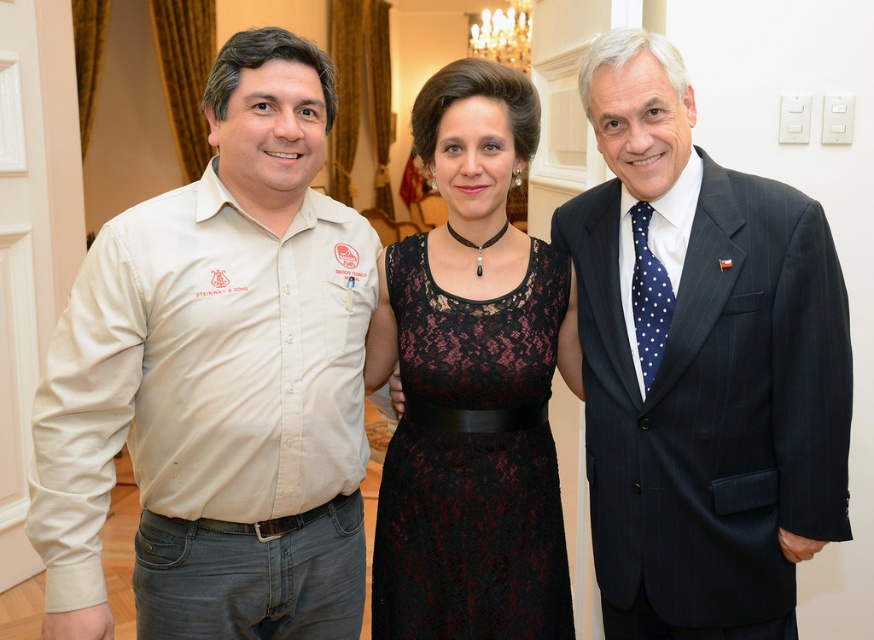
Question: Is the position of beige cotton shirt at left less distant than that of dark blue pinstripe suit at center?

Choices:
 (A) yes
 (B) no

Answer: (A)

Question: Is the position of beige cotton shirt at left more distant than that of black lace dress at center?

Choices:
 (A) no
 (B) yes

Answer: (A)

Question: Can you confirm if beige cotton shirt at left is thinner than dark blue pinstripe suit at center?

Choices:
 (A) no
 (B) yes

Answer: (A)

Question: Based on their relative distances, which object is farther from the dark blue pinstripe suit at center?

Choices:
 (A) beige cotton shirt at left
 (B) black lace dress at center

Answer: (A)

Question: Which point appears farthest from the camera in this image?

Choices:
 (A) (311, 582)
 (B) (493, 577)

Answer: (B)

Question: Which object appears closest to the camera in this image?

Choices:
 (A) beige cotton shirt at left
 (B) dark blue pinstripe suit at center

Answer: (A)